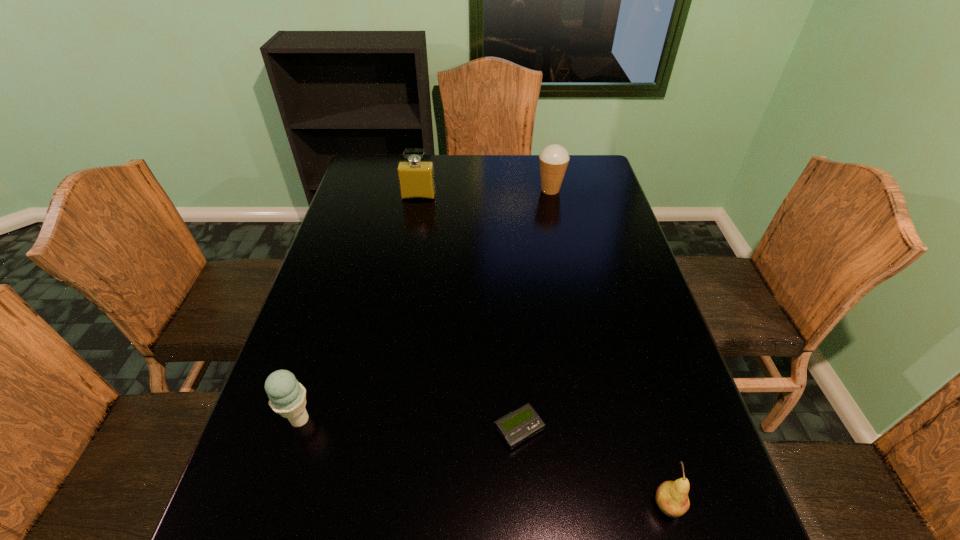
The width and height of the screenshot is (960, 540). What are the coordinates of `free spot between the fourth tallest object and the perfume` in the screenshot? It's located at (543, 351).

You are a GUI agent. You are given a task and a screenshot of the screen. Output one action in this format:
    pyautogui.click(x=<x>, y=<y>)
    Task: Click on the empty space that is in between the left ice cream and the fourth tallest object
    This screenshot has width=960, height=540.
    Given the screenshot: What is the action you would take?
    pyautogui.click(x=484, y=462)

I want to click on empty space that is in between the fourth tallest object and the beeper, so click(593, 467).

Find the location of a particular element. the second closest object to the nearer ice cream is located at coordinates (671, 497).

Image resolution: width=960 pixels, height=540 pixels. Find the location of `object that is the closest to the pear`. object that is the closest to the pear is located at coordinates (515, 427).

The image size is (960, 540). Identify the location of vacant region that satisfies the following two spatial constraints: 1. on the back side of the left ice cream; 2. on the left side of the right ice cream. (372, 190).

Where is `vacant space that satisfies the following two spatial constraints: 1. on the front-facing side of the perfume; 2. on the left side of the beeper`? vacant space that satisfies the following two spatial constraints: 1. on the front-facing side of the perfume; 2. on the left side of the beeper is located at coordinates (377, 429).

Image resolution: width=960 pixels, height=540 pixels. I want to click on free space in the image that satisfies the following two spatial constraints: 1. on the back side of the right ice cream; 2. on the right side of the nearer ice cream, so click(x=372, y=190).

This screenshot has width=960, height=540. In order to click on vacant area that satisfies the following two spatial constraints: 1. on the front side of the right ice cream; 2. on the left side of the second shortest object in this screenshot , I will do `click(615, 505)`.

Identify the location of vacant region that satisfies the following two spatial constraints: 1. on the front-facing side of the perfume; 2. on the left side of the rightmost object. The width and height of the screenshot is (960, 540). (364, 505).